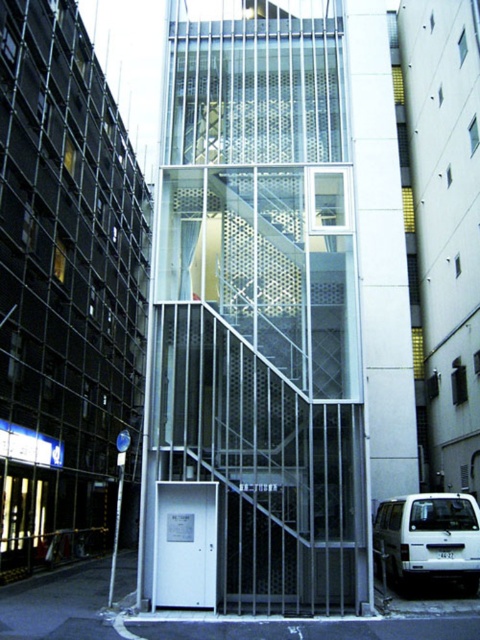
Question: Which point is closer to the camera?

Choices:
 (A) coord(384,572)
 (B) coord(283,134)

Answer: (A)

Question: Can you confirm if transparent glass elevator at center is bigger than white matte suv at lower right?

Choices:
 (A) no
 (B) yes

Answer: (B)

Question: Is transparent glass elevator at center below white matte suv at lower right?

Choices:
 (A) yes
 (B) no

Answer: (B)

Question: Considering the relative positions of transparent glass elevator at center and white matte suv at lower right in the image provided, where is transparent glass elevator at center located with respect to white matte suv at lower right?

Choices:
 (A) right
 (B) left

Answer: (B)

Question: Among these points, which one is nearest to the camera?

Choices:
 (A) (215, 372)
 (B) (412, 506)

Answer: (A)

Question: Which point is closer to the camera taking this photo?

Choices:
 (A) (458, 496)
 (B) (224, 180)

Answer: (A)